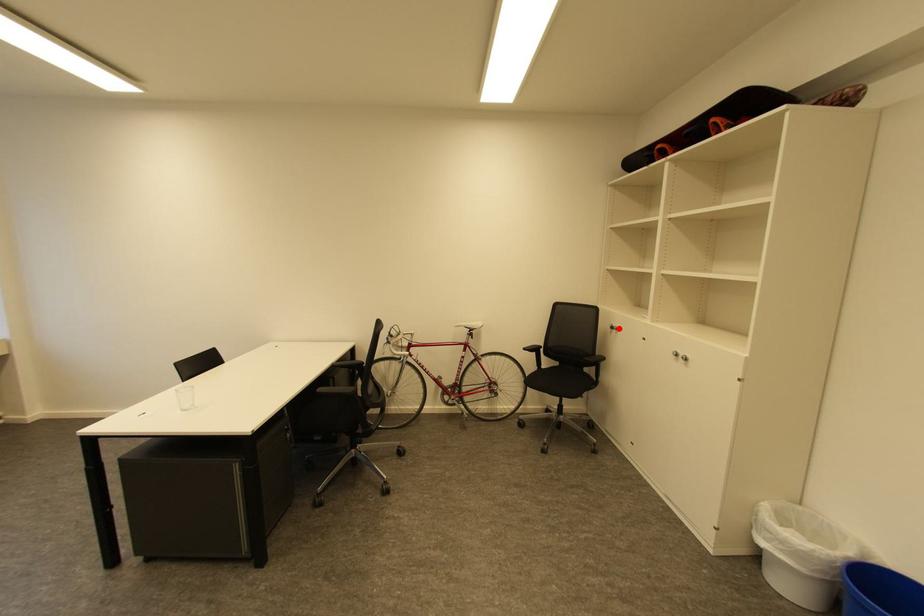
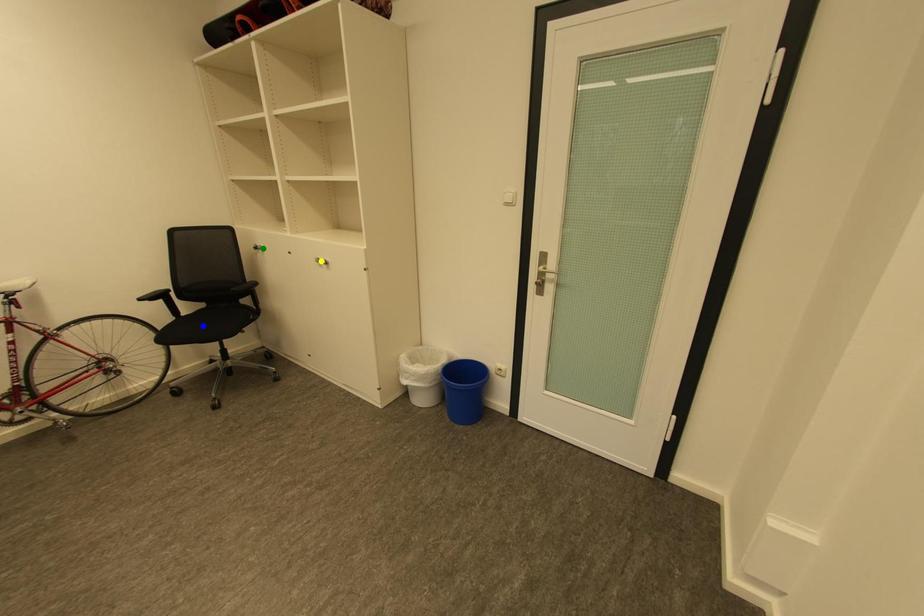
Question: I am providing you with two images of the same scene from different viewpoints. A red point is marked on the first image. You are given multiple points on the second image. Which mark in image 2 goes with the point in image 1?

Choices:
 (A) green point
 (B) blue point
 (C) yellow point

Answer: (A)